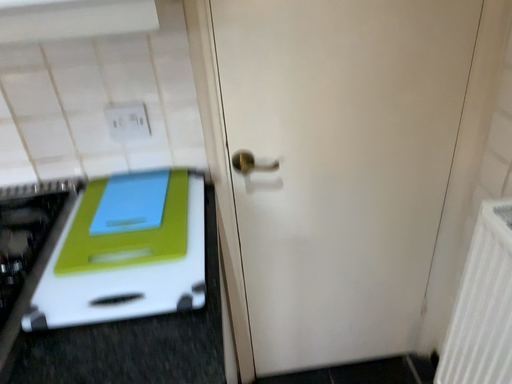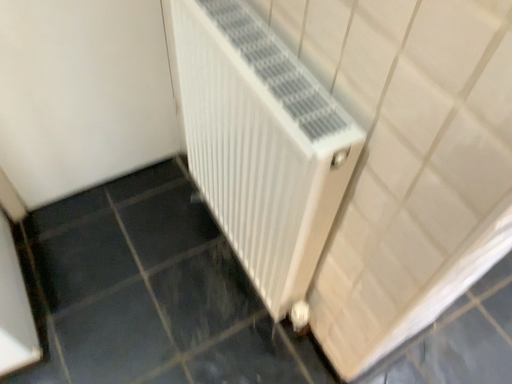
Question: Which way did the camera rotate in the video?

Choices:
 (A) rotated upward
 (B) rotated downward

Answer: (B)